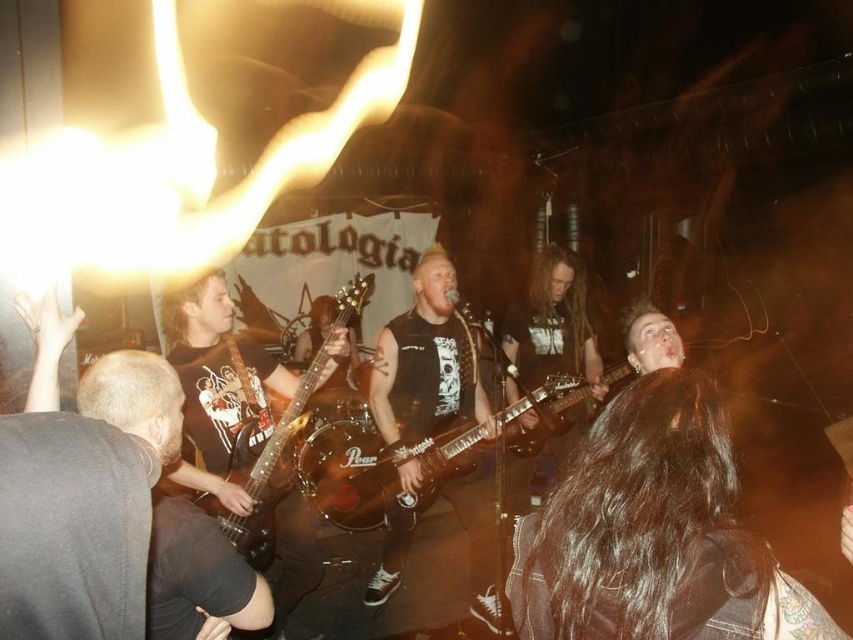
Is shiny black electric guitar at center taller than wooden electric guitar at center?

No, shiny black electric guitar at center is not taller than wooden electric guitar at center.

Between shiny black electric guitar at center and wooden electric guitar at center, which one is positioned higher?

wooden electric guitar at center is above.

Between point (437, 445) and point (258, 513), which one is positioned in front?

Point (258, 513)

Identify the location of shiny black electric guitar at center. This screenshot has height=640, width=853. (379, 468).